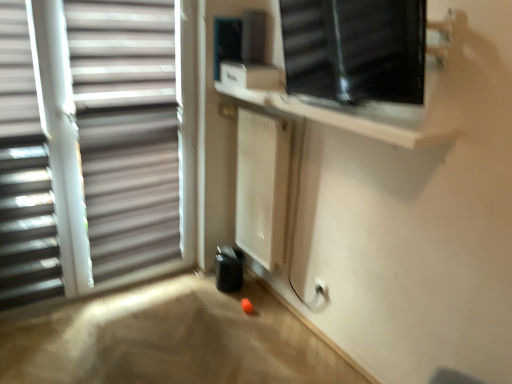
Question: Is transparent glass window at upper right, marked as the second window in a left-to-right arrangement, wider or thinner than white matte window blind at left?

Choices:
 (A) thin
 (B) wide

Answer: (B)

Question: Relative to white matte window blind at left, is transparent glass window at upper right, marked as the second window in a left-to-right arrangement, in front or behind?

Choices:
 (A) behind
 (B) front

Answer: (B)

Question: Estimate the real-world distances between objects in this image. Which object is farther from the white matte window at left, which appears as the first window when viewed from the left?

Choices:
 (A) transparent glass window at upper right, marked as the second window in a left-to-right arrangement
 (B) white matte window blind at left
 (C) white matte radiator at center

Answer: (A)

Question: Which is farther from the white matte window at left, which appears as the first window when viewed from the left?

Choices:
 (A) white matte window blind at left
 (B) transparent glass window at upper right, marked as the second window in a left-to-right arrangement
 (C) white matte radiator at center

Answer: (B)